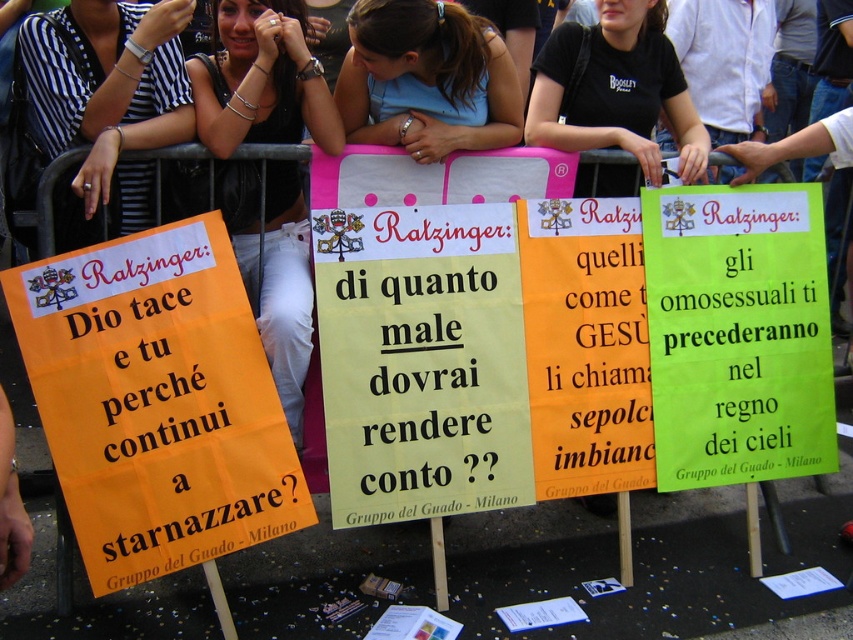
You are a photographer standing in front of the protest signs. You want to take a photo of both the green paper sign at center and the orange paper sign at center. Which sign should you adjust your camera to focus on first if you want to capture them in the correct spatial order from left to right?

The green paper sign at center is to the right of the orange paper sign at center. To capture them in the correct left to right order, focus on the orange paper sign at center first, then the green paper sign at center since the orange one is on the left.